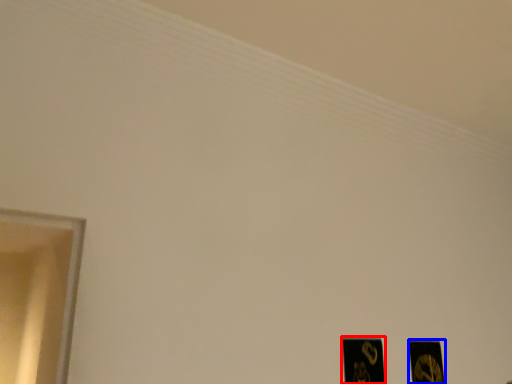
Question: Which of the following is the farthest to the observer, picture frame (highlighted by a red box) or picture frame (highlighted by a blue box)?

Choices:
 (A) picture frame
 (B) picture frame

Answer: (B)